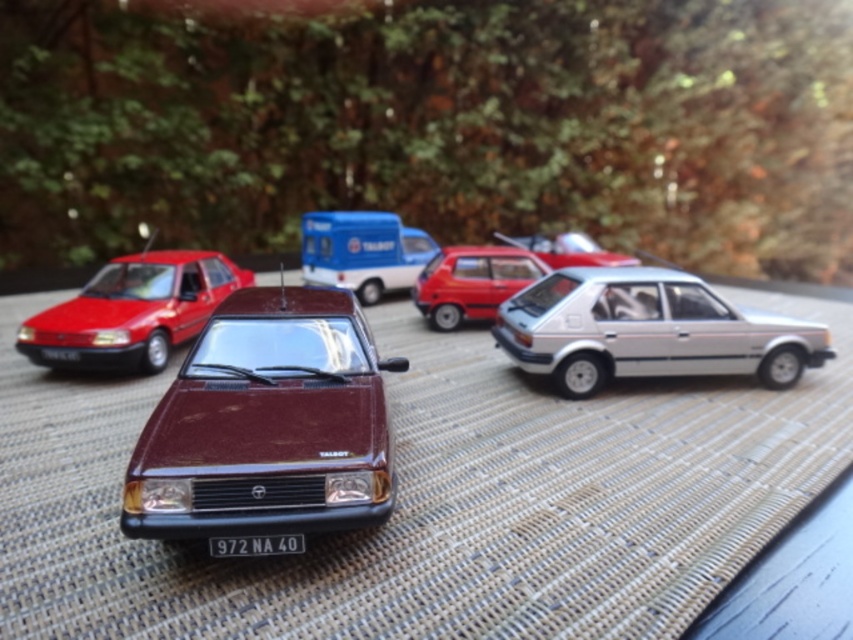
You are a collector looking at the miniature cars on a table. You want to place a new model car exactly where the silver metallic hatchback at right is currently located. What coordinates should you aim for?

The silver metallic hatchback at right is located at coordinates (648, 330), so you should aim for those coordinates to place the new model car there.

You are a collector organizing model cars on a table. You have a silver metallic hatchback at right and a black plastic license plate at center. Which object is located to the right of the other?

The silver metallic hatchback at right is positioned on the right side of black plastic license plate at center, so it is located to the right of the black plastic license plate at center.